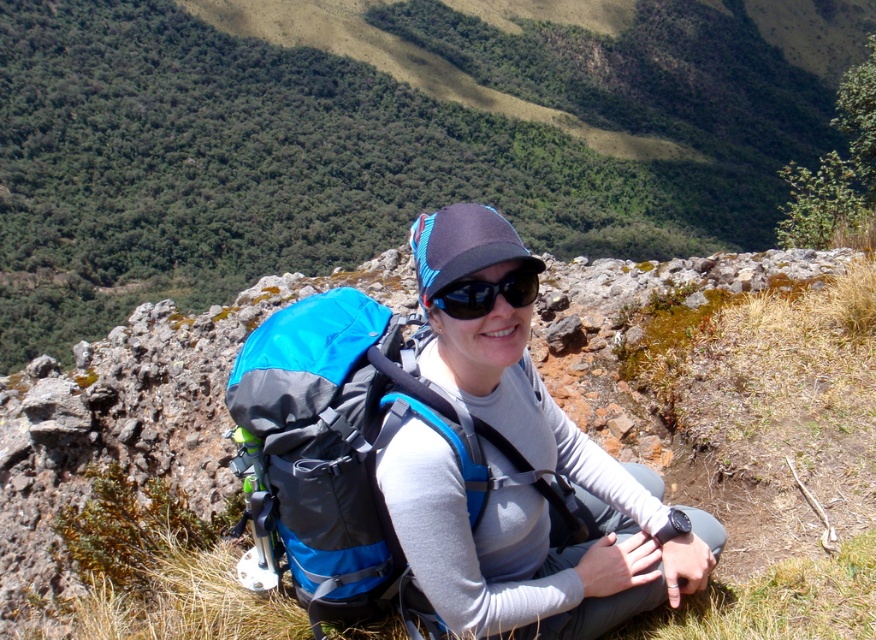
Consider the image. You are a hiker planning to take a photo of the green leafy hillside at upper center and the blue fabric backpack at center. Which object should you focus on first if you want to capture both in the same frame without moving the camera?

The blue fabric backpack at center should be focused on first because the green leafy hillside at upper center is positioned to its right, so adjusting focus to include both would require ensuring the backpack is centered before including the hillside in the frame.